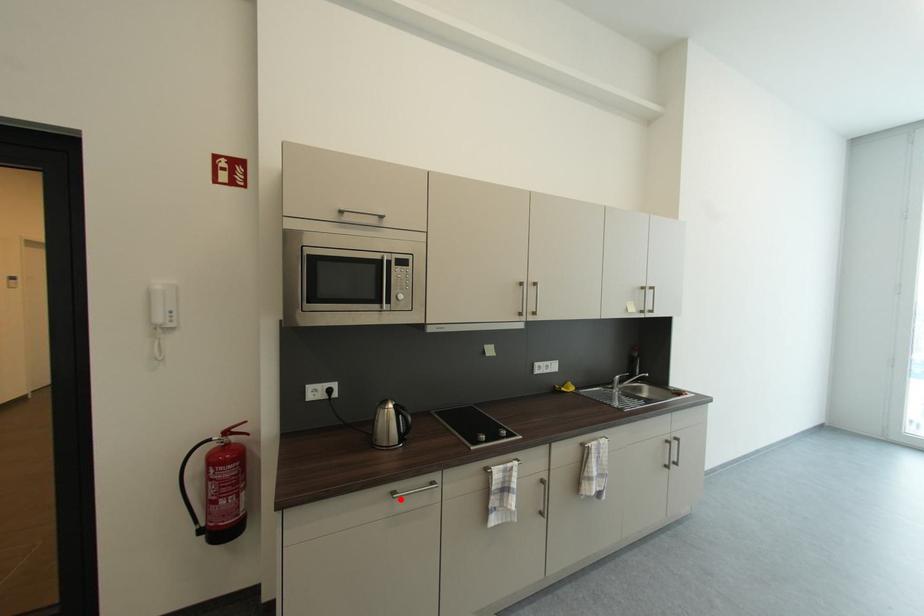
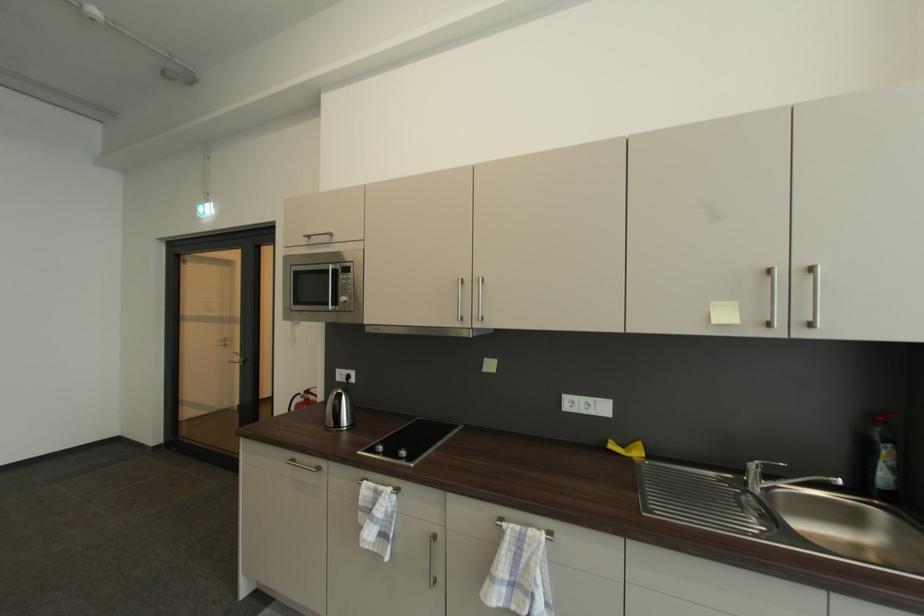
Question: I am providing you with two images of the same scene from different viewpoints. Image1 has a red point marked. In image2, the corresponding 3D location appears at what relative position? Reply with the corresponding letter.

Choices:
 (A) Closer
 (B) Farther

Answer: (B)